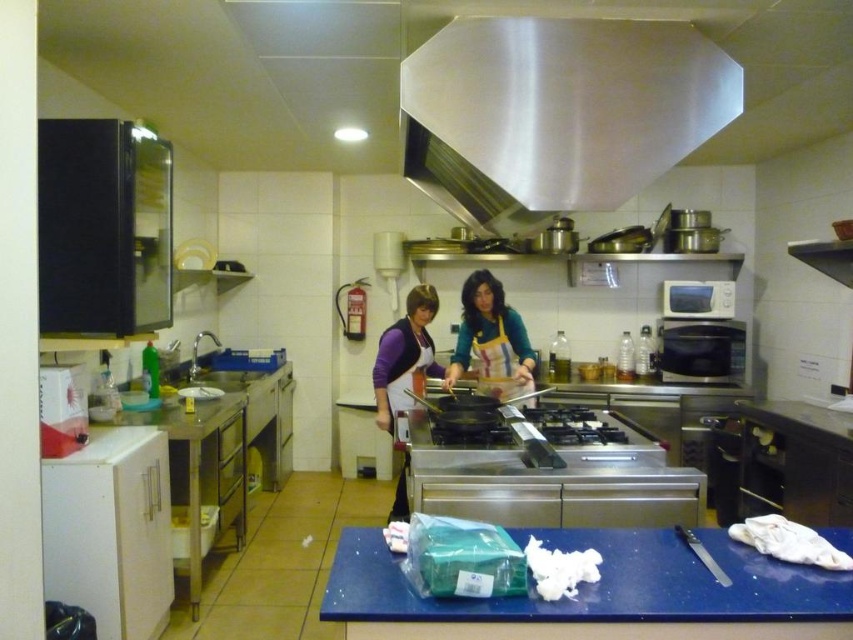
Does satin silver exhaust hood at upper center have a greater height compared to purple fabric apron at center?

No, satin silver exhaust hood at upper center is not taller than purple fabric apron at center.

Who is more forward, (457, 51) or (398, 502)?

Point (457, 51) is in front.

Who is more distant from viewer, (529, 97) or (407, 372)?

Positioned behind is point (407, 372).

This screenshot has height=640, width=853. In order to click on satin silver exhaust hood at upper center in this screenshot , I will do `click(556, 113)`.

Which is in front, point (476, 326) or point (376, 385)?

Positioned in front is point (376, 385).

The width and height of the screenshot is (853, 640). What do you see at coordinates (490, 337) in the screenshot?
I see `yellow apron at center` at bounding box center [490, 337].

Where is `yellow apron at center`? The image size is (853, 640). yellow apron at center is located at coordinates (490, 337).

Consider the image. Can you confirm if blue plastic cutting board at lower center is positioned to the right of purple fabric apron at center?

Yes, blue plastic cutting board at lower center is to the right of purple fabric apron at center.

Which is more to the right, blue plastic cutting board at lower center or purple fabric apron at center?

blue plastic cutting board at lower center is more to the right.

Which is behind, point (723, 561) or point (390, 371)?

The point (390, 371) is more distant.

Where is `blue plastic cutting board at lower center`? This screenshot has height=640, width=853. blue plastic cutting board at lower center is located at coordinates (599, 582).